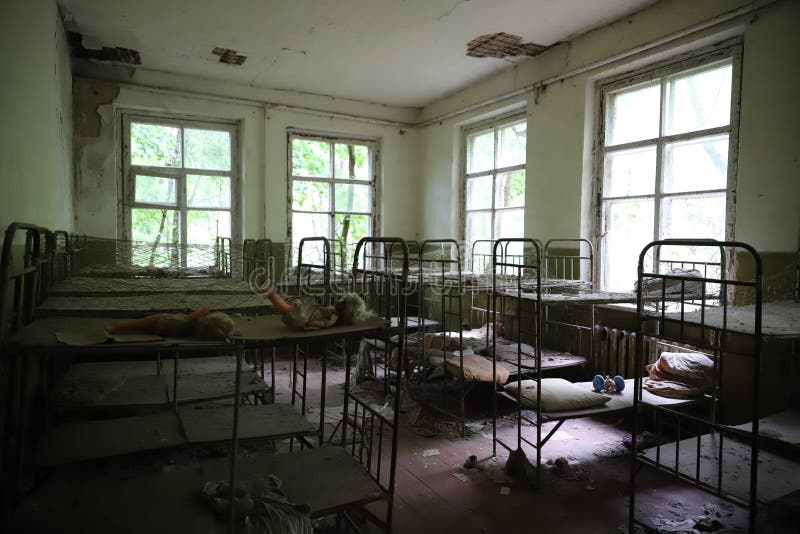
You are a GUI agent. You are given a task and a screenshot of the screen. Output one action in this format:
    pyautogui.click(x=<x>, y=<y>)
    Task: Click on the rungs for children to climb to get to top bunk
    Image resolution: width=800 pixels, height=534 pixels.
    Given the screenshot: What is the action you would take?
    pyautogui.click(x=529, y=441), pyautogui.click(x=528, y=420), pyautogui.click(x=532, y=402), pyautogui.click(x=526, y=351), pyautogui.click(x=530, y=309), pyautogui.click(x=298, y=392), pyautogui.click(x=300, y=373), pyautogui.click(x=298, y=348)